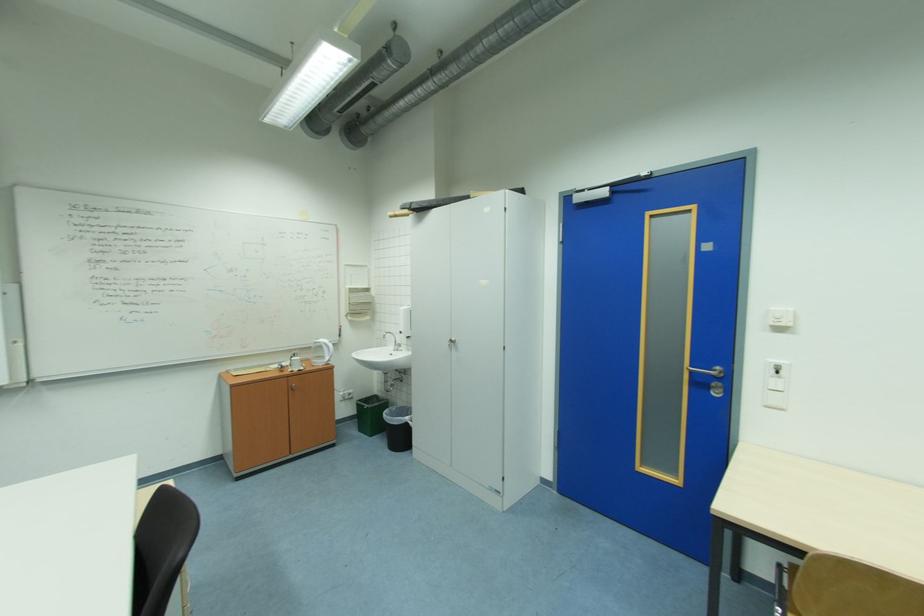
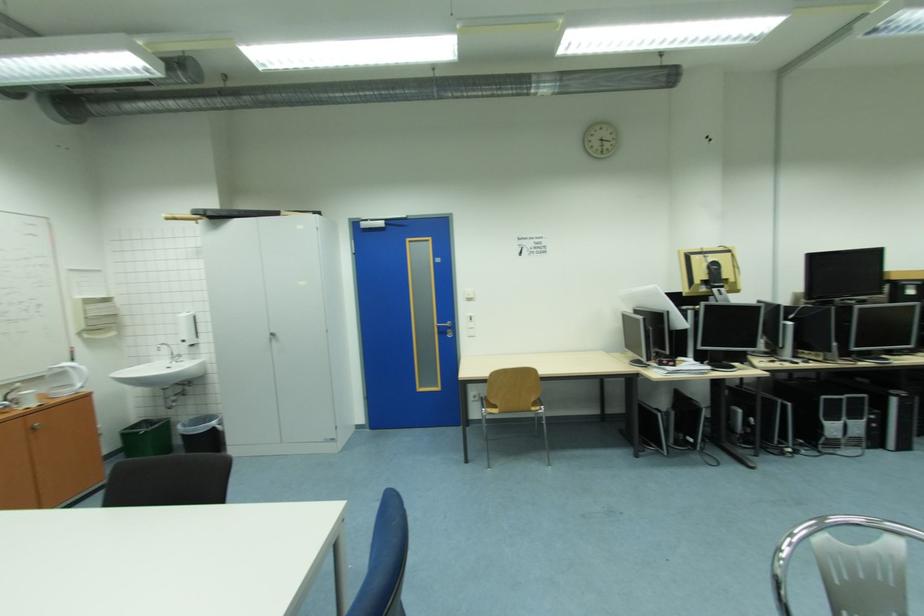
In the second image, find the point that corresponds to [699,373] in the first image.

(445, 328)